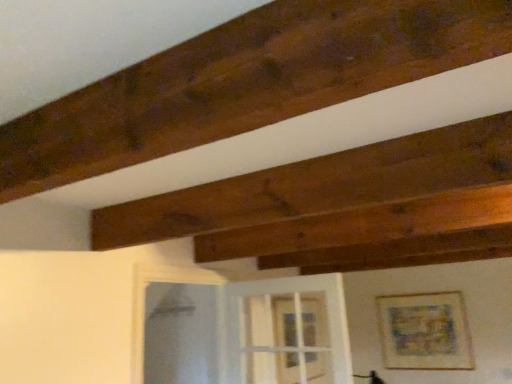
Question: From the image's perspective, is matte wooden picture frame at upper right located beneath transparent glass door at center?

Choices:
 (A) yes
 (B) no

Answer: (A)

Question: Is matte wooden picture frame at upper right with transparent glass door at center?

Choices:
 (A) yes
 (B) no

Answer: (B)

Question: Considering the relative sizes of matte wooden picture frame at upper right and transparent glass door at center in the image provided, is matte wooden picture frame at upper right smaller than transparent glass door at center?

Choices:
 (A) no
 (B) yes

Answer: (B)

Question: Does matte wooden picture frame at upper right appear on the right side of transparent glass door at center?

Choices:
 (A) no
 (B) yes

Answer: (B)

Question: Is matte wooden picture frame at upper right completely or partially outside of transparent glass door at center?

Choices:
 (A) no
 (B) yes

Answer: (B)

Question: Is transparent glass door at center to the left or to the right of matte wooden picture frame at upper right in the image?

Choices:
 (A) right
 (B) left

Answer: (B)

Question: From the image's perspective, relative to matte wooden picture frame at upper right, is transparent glass door at center above or below?

Choices:
 (A) below
 (B) above

Answer: (B)

Question: Is transparent glass door at center inside the boundaries of matte wooden picture frame at upper right, or outside?

Choices:
 (A) outside
 (B) inside

Answer: (A)

Question: From a real-world perspective, relative to matte wooden picture frame at upper right, is transparent glass door at center vertically above or below?

Choices:
 (A) above
 (B) below

Answer: (A)

Question: Do you think matte wooden picture frame at upper right is within transparent glass door at center, or outside of it?

Choices:
 (A) inside
 (B) outside

Answer: (B)

Question: From their relative heights in the image, would you say matte wooden picture frame at upper right is taller or shorter than transparent glass door at center?

Choices:
 (A) short
 (B) tall

Answer: (B)

Question: Relative to transparent glass door at center, is matte wooden picture frame at upper right in front or behind?

Choices:
 (A) front
 (B) behind

Answer: (B)

Question: From a real-world perspective, relative to transparent glass door at center, is matte wooden picture frame at upper right vertically above or below?

Choices:
 (A) above
 (B) below

Answer: (B)

Question: Would you say transparent glass door at center is to the left or to the right of clear glass screen door at lower center in the picture?

Choices:
 (A) right
 (B) left

Answer: (A)

Question: Considering the positions of transparent glass door at center and clear glass screen door at lower center in the image, is transparent glass door at center wider or thinner than clear glass screen door at lower center?

Choices:
 (A) wide
 (B) thin

Answer: (B)